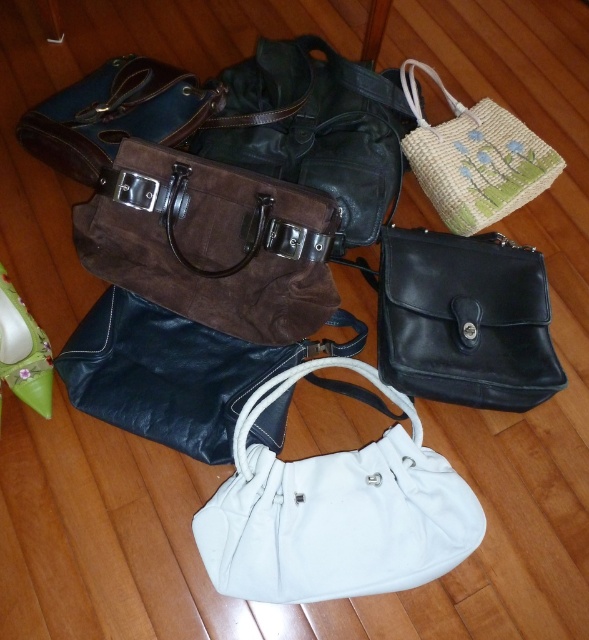
Does point (462, 108) come behind point (34, 390)?

That is True.

Where is `woven straw bag at upper right`? woven straw bag at upper right is located at coordinates (474, 157).

Between black leather handbag at center and green fabric purse at lower left, which one is positioned higher?

green fabric purse at lower left is above.

Where is `black leather handbag at center`? The image size is (589, 640). black leather handbag at center is located at coordinates (174, 371).

Locate an element on the screen. Image resolution: width=589 pixels, height=640 pixels. black leather handbag at center is located at coordinates (174, 371).

Does white leather handbag at center appear under black leather bag at center?

Correct, white leather handbag at center is located below black leather bag at center.

Does point (426, 513) come closer to viewer compared to point (542, 336)?

Yes, point (426, 513) is in front of point (542, 336).

Locate an element on the screen. The height and width of the screenshot is (640, 589). white leather handbag at center is located at coordinates (335, 512).

Locate an element on the screen. The width and height of the screenshot is (589, 640). white leather handbag at center is located at coordinates (335, 512).